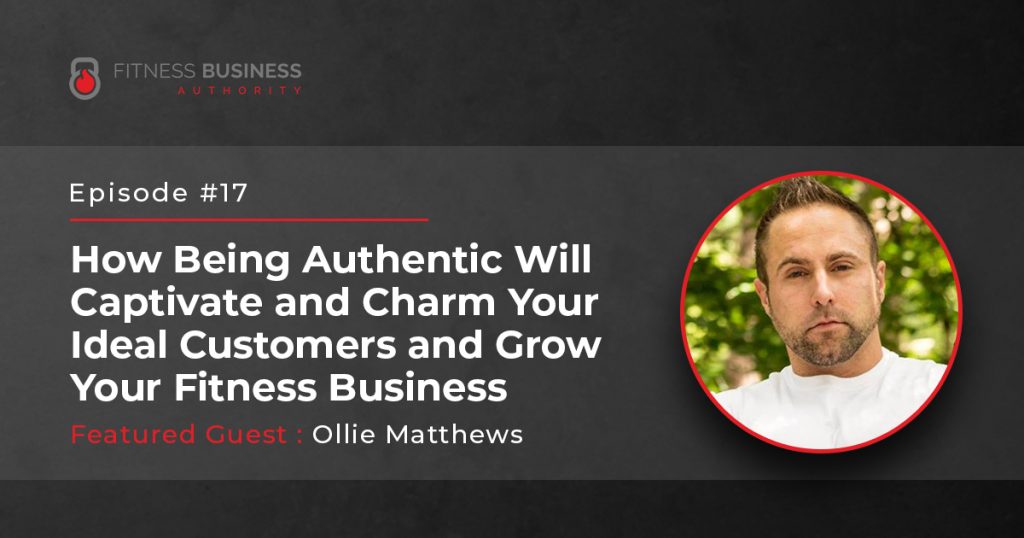
Find the location of a particular element. red picture border is located at coordinates (682, 343).